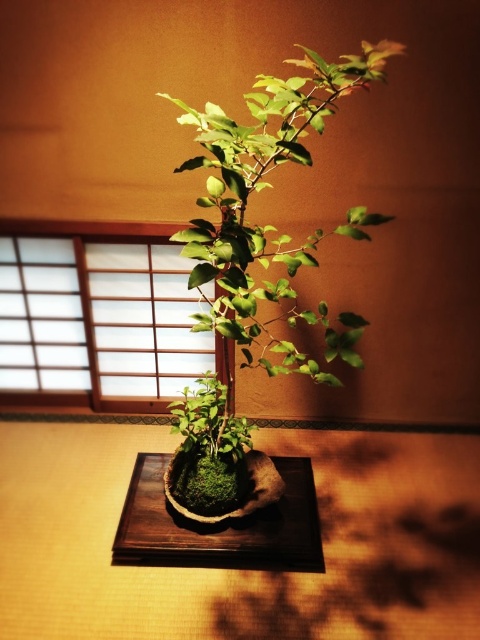
Looking at this image, you are a gardener inspecting the bonsai setup. You need to water the bonsai tree. Which object should you water first, the green mossy pot at center or the dark brown wooden tray at center?

You should water the green mossy pot at center first because it is in front of the dark brown wooden tray at center, making it more accessible.

You are standing in the room and want to water the bonsai tree in the green mossy pot at center. The watering can is placed 2 meters away from you. Can you reach the pot without moving your position?

The green mossy pot at center is 1.99 meters from viewer, which is just within reach of the watering can placed 2 meters away. Therefore, you can reach the pot without moving.

You are arranging a display and need to place a small decorative stone between the green mossy pot at center and the dark brown wooden tray at center. Based on their positions, where should you place the stone?

The green mossy pot at center is positioned on the right side of the dark brown wooden tray at center, so you should place the stone between them to the right of the dark brown wooden tray at center and to the left of the green mossy pot at center.